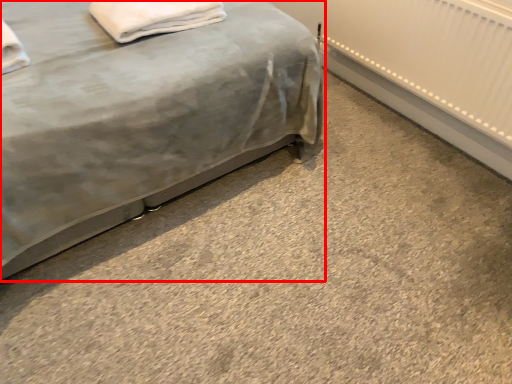
Question: Considering the relative positions of bed (annotated by the red box) and material in the image provided, where is bed (annotated by the red box) located with respect to the staircase?

Choices:
 (A) left
 (B) right

Answer: (A)